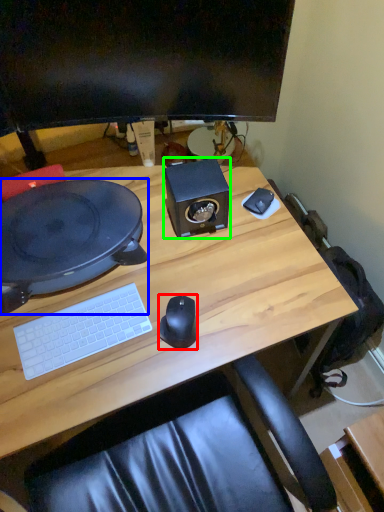
Question: Considering the real-world distances, which object is farthest from mouse (highlighted by a red box)? desktop (highlighted by a blue box) or speaker (highlighted by a green box)?

Choices:
 (A) desktop
 (B) speaker

Answer: (A)